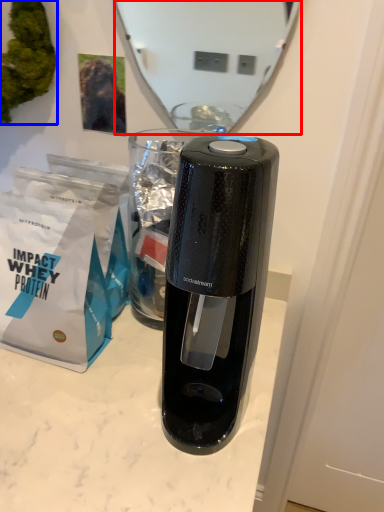
Question: Which point is closer to the camera, mirror (highlighted by a red box) or plant (highlighted by a blue box)?

Choices:
 (A) mirror
 (B) plant

Answer: (A)